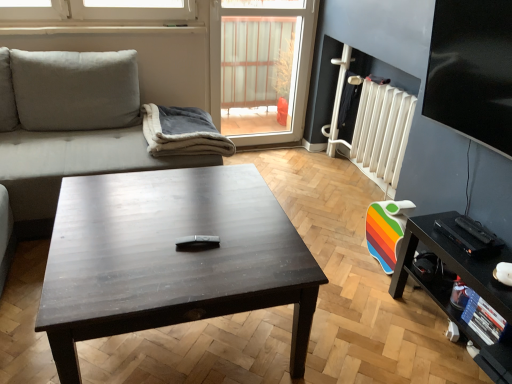
Question: Do you think transparent glass window screen at upper right, which is the 1th window screen from right to left, is within suede-like beige couch at left, or outside of it?

Choices:
 (A) inside
 (B) outside

Answer: (B)

Question: Looking at their shapes, would you say transparent glass window screen at upper right, acting as the 1th window screen starting from the front, is wider or thinner than suede-like beige couch at left?

Choices:
 (A) thin
 (B) wide

Answer: (A)

Question: Which object is the closest to the suede-like beige couch at left?

Choices:
 (A) dark wood coffee table at center
 (B) gray fleece blanket at center
 (C) white plastic radiator at right
 (D) transparent plastic window screen at upper center, which appears as the 1th window screen when viewed from the left
 (E) black glossy tv stand at lower right

Answer: (B)

Question: Estimate the real-world distances between objects in this image. Which object is closer to the transparent glass window screen at upper right, which ranks as the second window screen in back-to-front order?

Choices:
 (A) suede-like beige couch at left
 (B) transparent plastic window screen at upper center, placed as the first window screen when sorted from back to front
 (C) dark wood coffee table at center
 (D) gray fleece blanket at center
 (E) black glossy tv stand at lower right

Answer: (E)